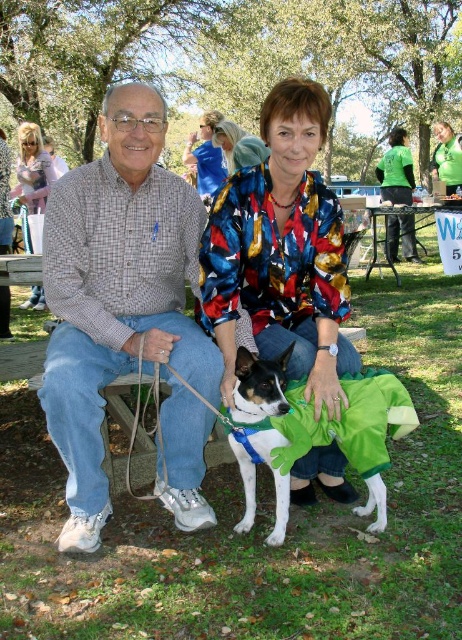
Question: Which point is closer to the camera?

Choices:
 (A) (389, 264)
 (B) (37, 125)
 (C) (204, 241)
 (D) (449, 173)

Answer: (C)

Question: Is gray checkered shirt at left above green fabric shirt at center?

Choices:
 (A) no
 (B) yes

Answer: (A)

Question: Considering the relative positions of green fabric dog at center and blonde hair at upper left in the image provided, where is green fabric dog at center located with respect to blonde hair at upper left?

Choices:
 (A) below
 (B) above

Answer: (A)

Question: Among these points, which one is nearest to the camera?

Choices:
 (A) (172, 364)
 (B) (255, 486)

Answer: (A)

Question: Estimate the real-world distances between objects in this image. Which object is farther from the gray checkered shirt at left?

Choices:
 (A) green fabric dog at center
 (B) blonde hair at upper left
 (C) black metal picnic table at center

Answer: (C)

Question: Does blonde hair at upper left have a smaller size compared to black metal picnic table at center?

Choices:
 (A) yes
 (B) no

Answer: (A)